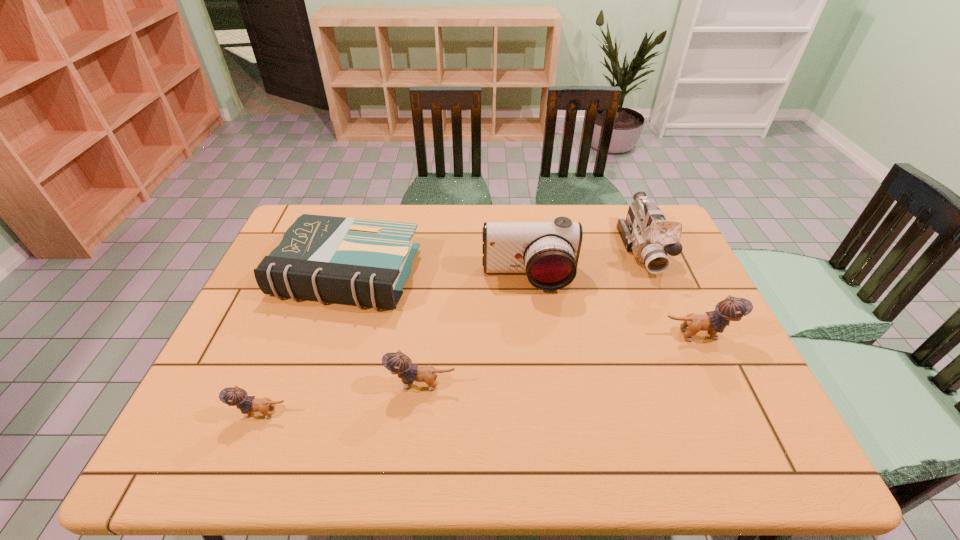
The image size is (960, 540). Identify the location of the nearest object. (233, 396).

Find the location of a particular element. This screenshot has height=540, width=960. the shortest kitten is located at coordinates (233, 396).

Identify the location of the second tallest kitten. The height and width of the screenshot is (540, 960). (398, 363).

Find the location of a particular element. the second farthest kitten is located at coordinates (398, 363).

At what (x,y) coordinates should I click in order to perform the action: click on the farthest kitten. Please return your answer as a coordinate pair (x, y). Looking at the image, I should click on (730, 309).

Find the location of a particular element. the fourth farthest object is located at coordinates (730, 309).

The height and width of the screenshot is (540, 960). I want to click on paperback book, so click(366, 262).

At what (x,y) coordinates should I click in order to perform the action: click on the right camcorder. Please return your answer as a coordinate pair (x, y). The width and height of the screenshot is (960, 540). Looking at the image, I should click on (646, 232).

Identify the location of the third object from right to left. The width and height of the screenshot is (960, 540). (548, 252).

I want to click on free point located on the front-facing side of the nearest kitten, so click(203, 413).